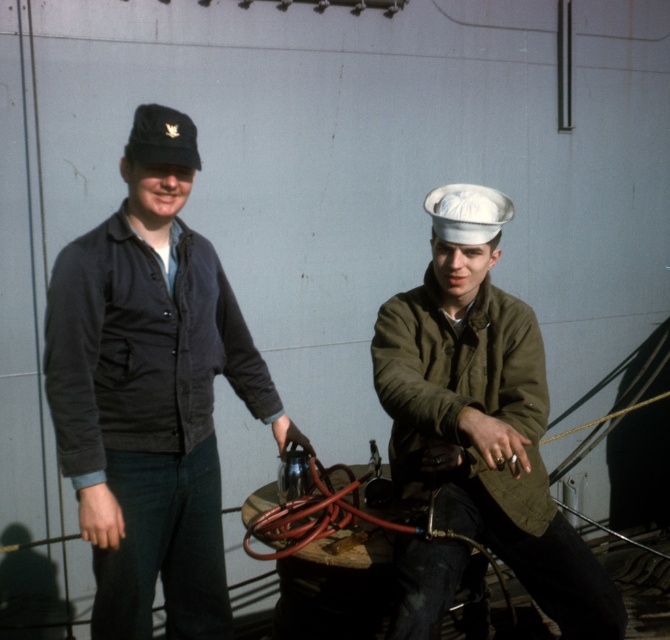
In the scene shown: You are a photographer trying to capture a closeup shot of both the khaki woolen jacket at right and the olive green woolen jacket at right. Given that your camera can only focus on objects within a 1.25 inch range, will you be able to get both jackets in focus?

The khaki woolen jacket at right and olive green woolen jacket at right are 1.50 inches apart from each other. Since the distance between them exceeds the camera focus range of 1.25 inches, you won not be able to get both jackets in focus.

Based on the scene description, where is the khaki woolen jacket at right located in terms of its 2D coordinates?

The khaki woolen jacket at right is located at the 2D coordinates of point (484, 429).

You are on the deck of a ship and see two jackets hanging on a rack. The khaki woolen jacket at right and the olive green woolen jacket at right. Which one is nearer to you?

The khaki woolen jacket at right is closer to the viewer than the olive green woolen jacket at right.